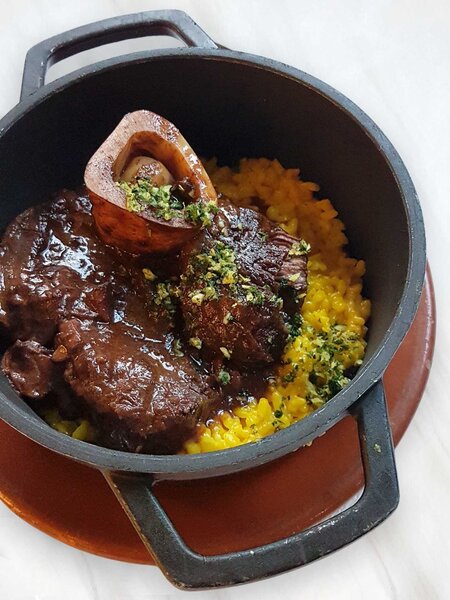
The height and width of the screenshot is (600, 450). In order to click on brown round tray in this screenshot , I will do `click(94, 489)`.